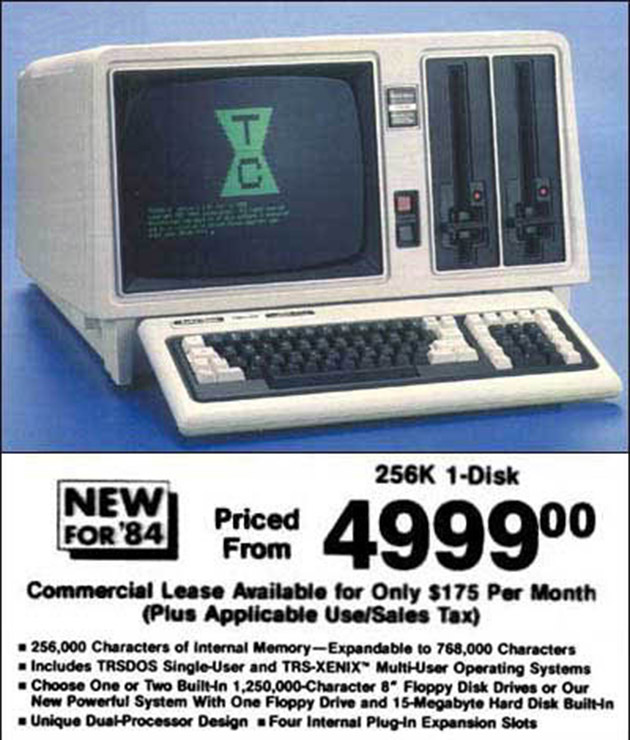
Image resolution: width=630 pixels, height=740 pixels. In order to click on black screen in this screenshot , I will do `click(183, 141)`.